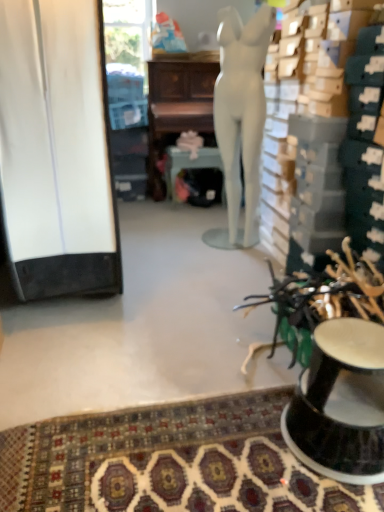
This screenshot has width=384, height=512. I want to click on vacant area located to the right-hand side of white matte cabinet at left, so click(181, 278).